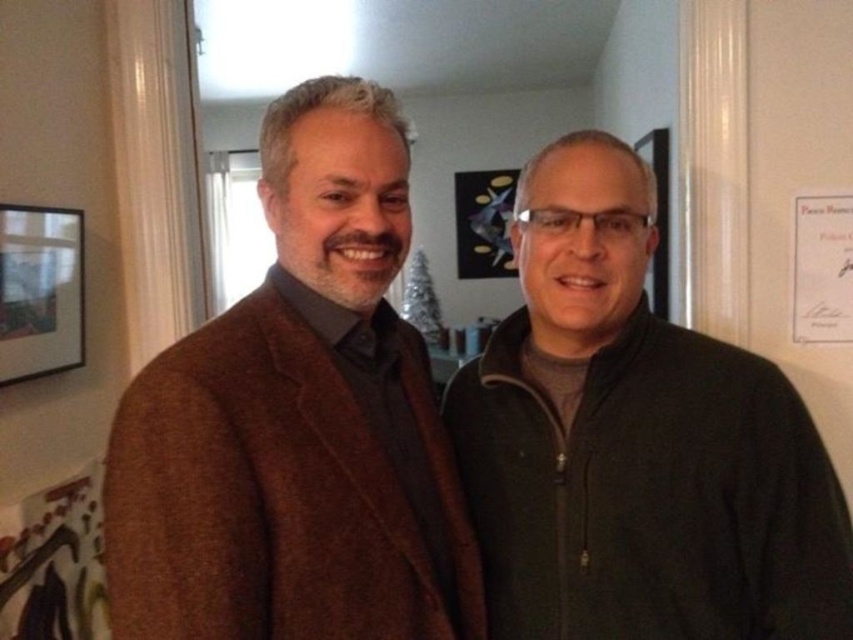
You are standing in the room and want to reach both points. Which point, point [393,252] or point [613,266], would you reach first if you move towards them?

Point [393,252] is closer to the viewer than point [613,266], so you would reach point [393,252] first.

You are a photographer setting up a shoot in this room. You need to position a 1.8m tall tripod between the dark green fleece at center and the black matte picture frame at upper left. Will the tripod fit vertically between them without exceeding their heights?

The dark green fleece at center is much taller than the black matte picture frame at upper left. Since the tripod is 1.8m tall, it might exceed the height of the black matte picture frame at upper left but may align with the dark green fleece at center. However, without exact measurements, it is uncertain if it will fit perfectly.